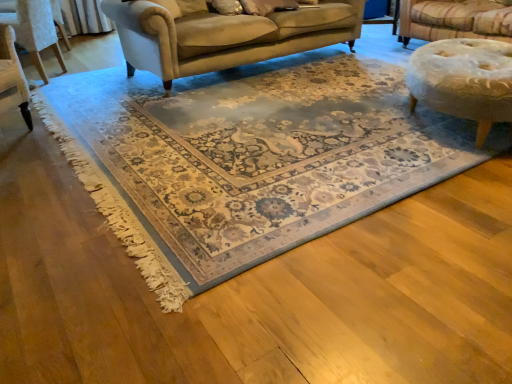
Question: Is velvet upholstered chair at upper left wider or thinner than beige wool rug at center?

Choices:
 (A) wide
 (B) thin

Answer: (B)

Question: From their relative heights in the image, would you say velvet upholstered chair at upper left is taller or shorter than beige wool rug at center?

Choices:
 (A) short
 (B) tall

Answer: (B)

Question: In the image, is velvet upholstered chair at upper left on the left side or the right side of beige wool rug at center?

Choices:
 (A) left
 (B) right

Answer: (A)

Question: Does point (451, 139) appear closer or farther from the camera than point (40, 76)?

Choices:
 (A) farther
 (B) closer

Answer: (B)

Question: Looking at their shapes, would you say beige wool rug at center is wider or thinner than velvet upholstered chair at upper left?

Choices:
 (A) wide
 (B) thin

Answer: (A)

Question: Is beige wool rug at center inside the boundaries of velvet upholstered chair at upper left, or outside?

Choices:
 (A) outside
 (B) inside

Answer: (A)

Question: Considering their positions, is beige wool rug at center located in front of or behind velvet upholstered chair at upper left?

Choices:
 (A) behind
 (B) front

Answer: (B)